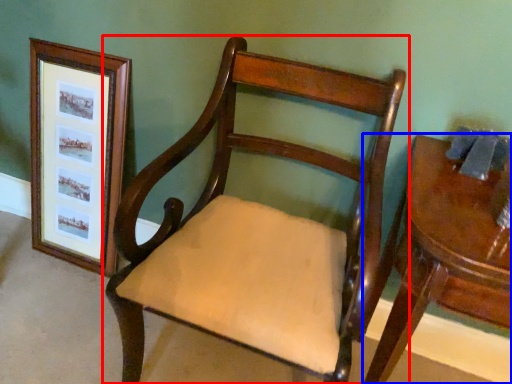
Question: Which object is further to the camera taking this photo, chair (highlighted by a red box) or table (highlighted by a blue box)?

Choices:
 (A) chair
 (B) table

Answer: (B)